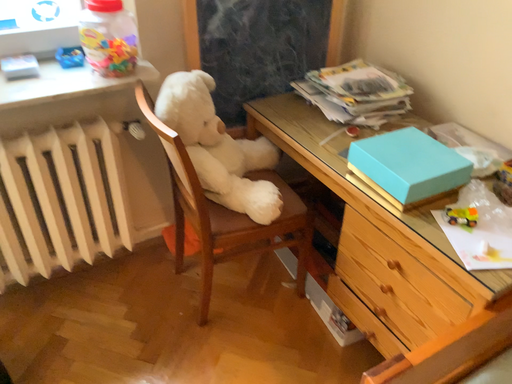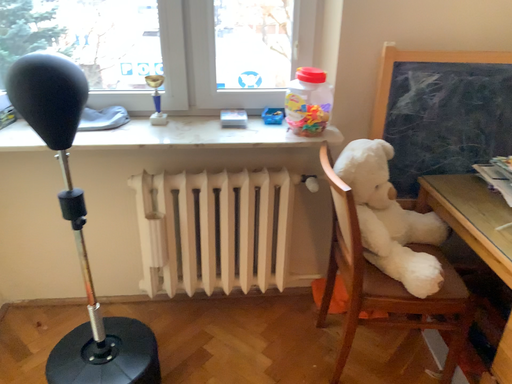
Question: Which way did the camera rotate in the video?

Choices:
 (A) rotated right
 (B) rotated left

Answer: (B)